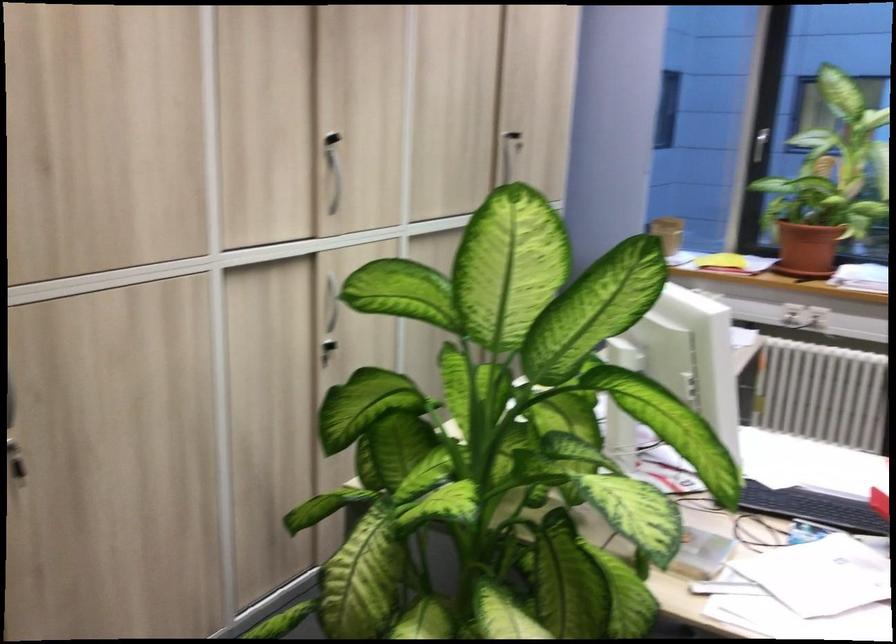
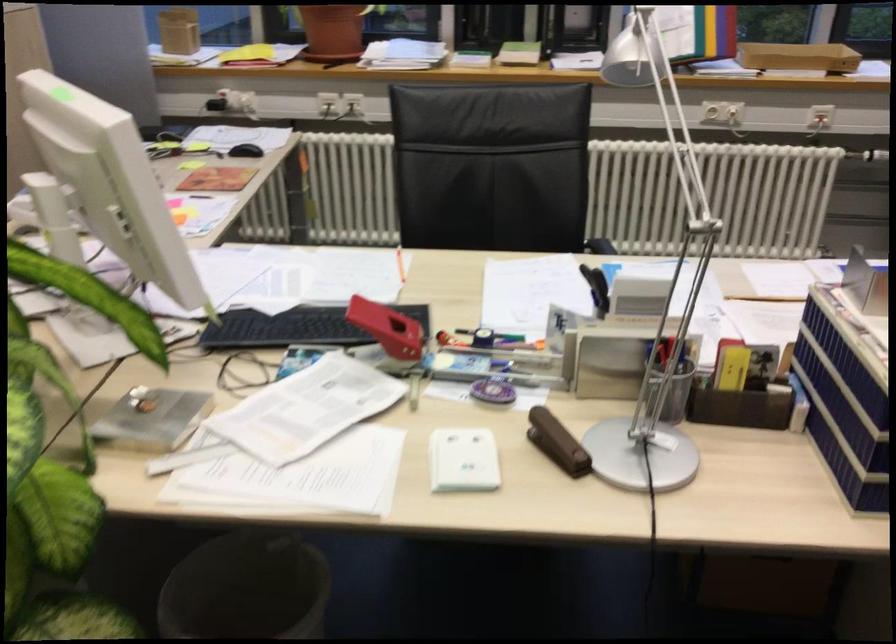
The first image is from the beginning of the video and the second image is from the end. How did the camera likely rotate when shooting the video?

The camera rotated toward right-down.